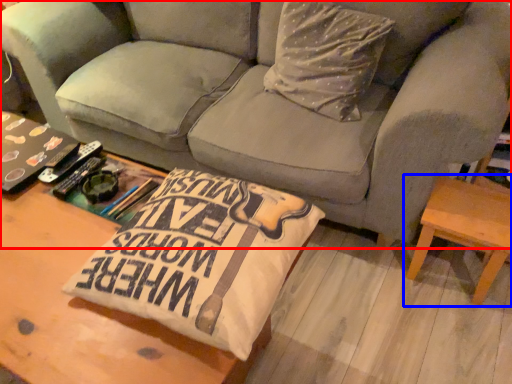
Question: Among these objects, which one is nearest to the camera, studio couch (highlighted by a red box) or table (highlighted by a blue box)?

Choices:
 (A) studio couch
 (B) table

Answer: (A)